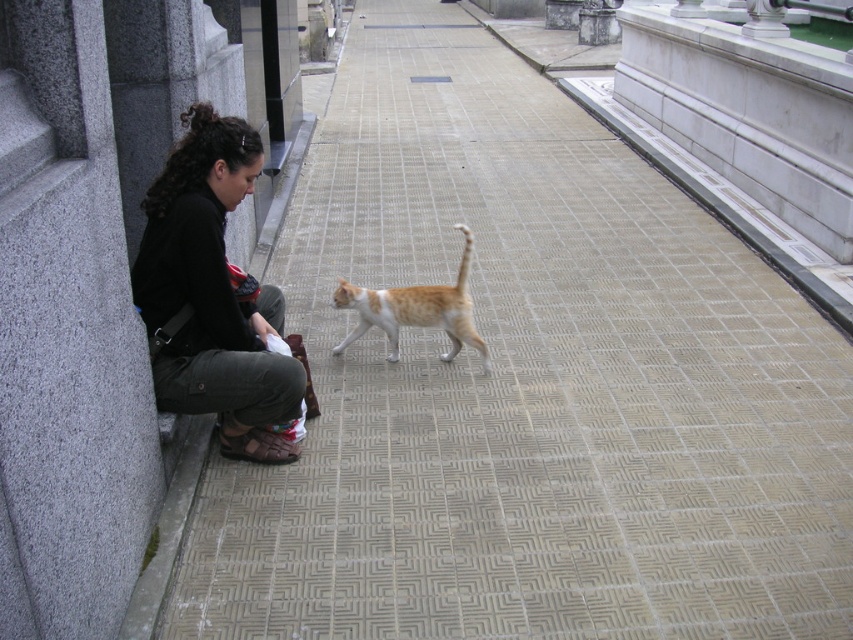
Is dark brown leather jacket at lower left behind orange fur cat at center?

No, dark brown leather jacket at lower left is closer to the viewer.

Is dark brown leather jacket at lower left closer to camera compared to orange fur cat at center?

Yes, it is in front of orange fur cat at center.

Which is behind, point (183, 339) or point (415, 291)?

Positioned behind is point (415, 291).

The image size is (853, 640). In order to click on dark brown leather jacket at lower left in this screenshot , I will do tap(212, 294).